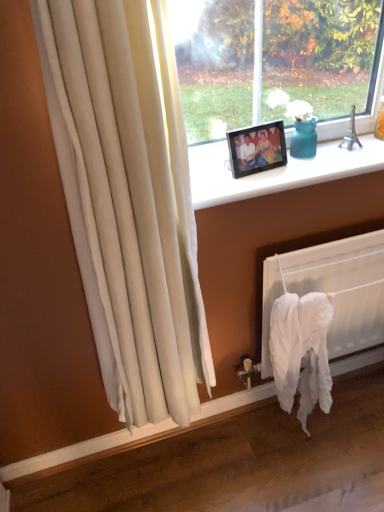
Question: From the image's perspective, is black plastic frame at upper center above or below white fabric at lower right?

Choices:
 (A) below
 (B) above

Answer: (B)

Question: In terms of height, does black plastic frame at upper center look taller or shorter compared to white fabric at lower right?

Choices:
 (A) tall
 (B) short

Answer: (B)

Question: Estimate the real-world distances between objects in this image. Which object is farther from the black plastic picture frame at upper center?

Choices:
 (A) black plastic frame at upper center
 (B) white fabric at lower right

Answer: (B)

Question: Which object is positioned farthest from the white fabric at lower right?

Choices:
 (A) black plastic frame at upper center
 (B) black plastic picture frame at upper center

Answer: (B)